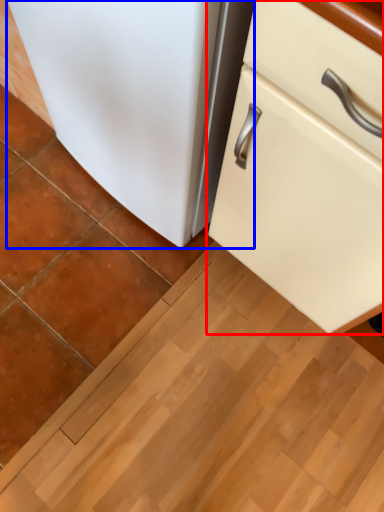
Question: Which of the following is the farthest to the observer, cabinetry (highlighted by a red box) or refrigerator (highlighted by a blue box)?

Choices:
 (A) cabinetry
 (B) refrigerator

Answer: (B)